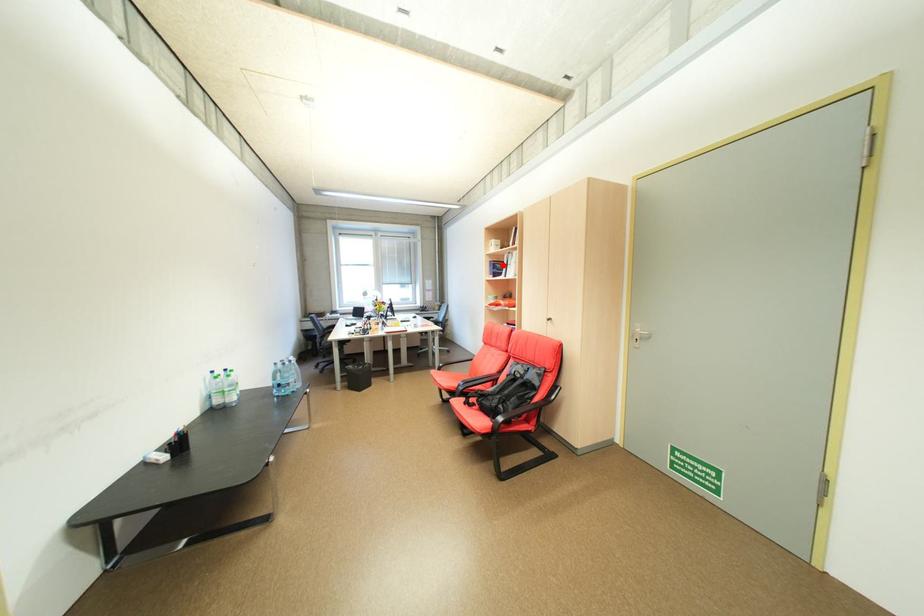
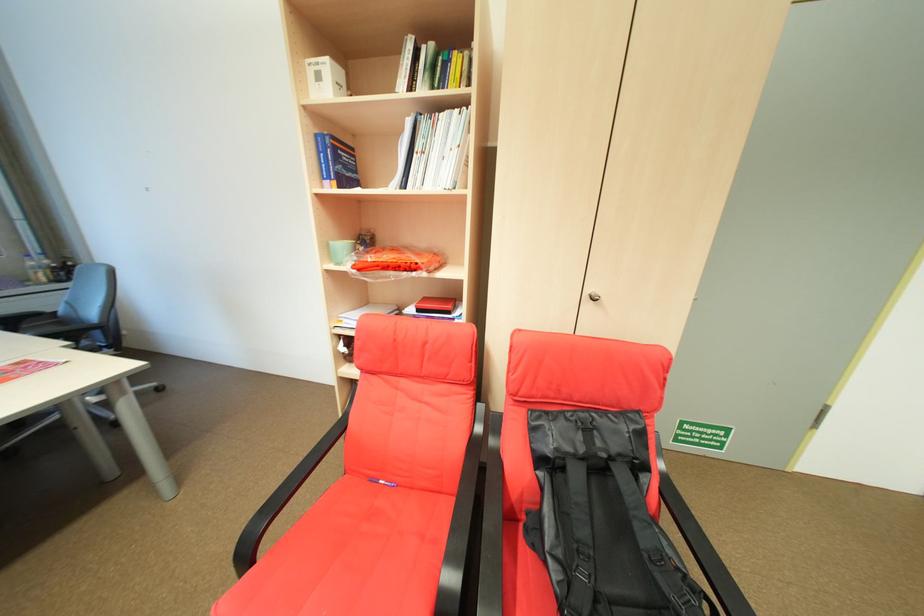
In the second image, find the point that corresponds to the highlighted location in the first image.

(344, 148)